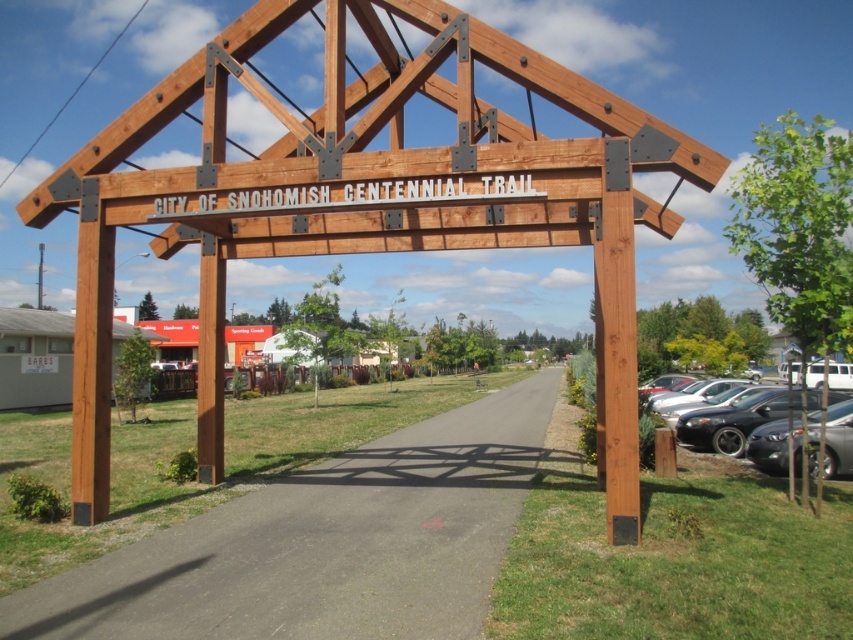
You are standing at the entrance of the City of Snohomish Centennial Trail and see two points marked on the pathway. The first point is at coordinates point (276, 563) and the second is at point (793, 445). Which point is closer to you?

Point (276, 563) is closer to the camera than point (793, 445), so the first point is closer to you.

You are standing at the entrance of the City of Snohomish Centennial Trail and want to take a photo of the natural wood sign at center and the asphalt path at center. Which object should you focus on first to ensure both are in the frame?

You should focus on the natural wood sign at center first because it is closer to you than the asphalt path at center, ensuring both are in the frame.

From the picture: You are standing at the entrance of the City of Snohomish Centennial Trail and want to take a photo that includes both the wooden archway and the parking area. If you focus your camera on point [445,456] and then adjust the lens to include point [775,412], will the parking area appear smaller or larger in the photo compared to when you first focused on the first point?

Point [445,456] is closer to the viewer than point [775,412]. When you focus on the closer point, the parking area will appear larger in the photo compared to when you adjust the lens to include the farther point.